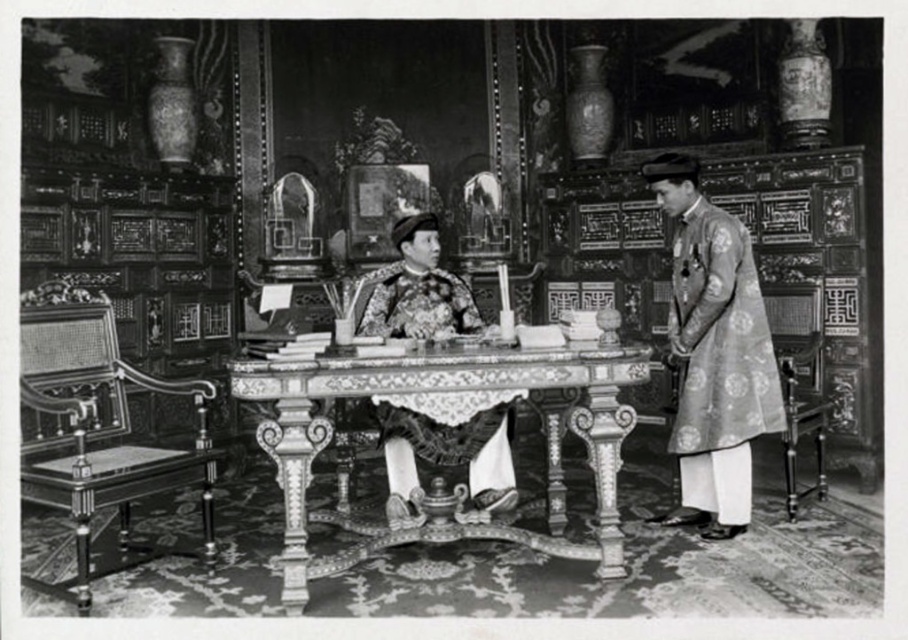
You are an interior designer planning to place a new sofa in this room. The sofa is as wide as the silky brocade robe at right. Can the sofa fit on the decorative wood table at center without overlapping its edges?

The decorative wood table at center is wider than the silky brocade robe at right. Since the sofa is as wide as the robe, it will fit on the table without overlapping the edges.

You are an interior designer planning to place a large decorative item in this room. You have the decorative wood table at center and the silky brocade robe at right in view. Which object should you consider for placement adjustments to accommodate the new item, and why?

The decorative wood table at center is bigger than the silky brocade robe at right, so you should consider moving the decorative wood table at center to accommodate the new large item since it occupies more space.